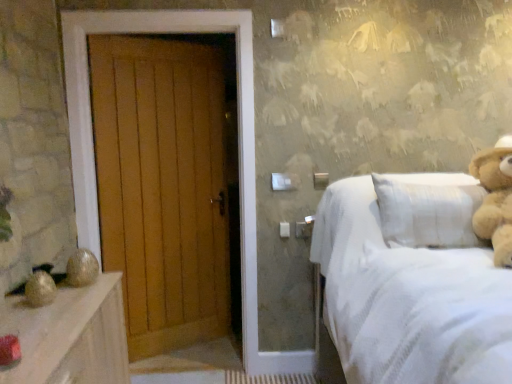
This screenshot has height=384, width=512. What do you see at coordinates (407, 299) in the screenshot? I see `white textured bed at right` at bounding box center [407, 299].

What do you see at coordinates (495, 198) in the screenshot? This screenshot has height=384, width=512. I see `light brown plush teddy bear at right` at bounding box center [495, 198].

You are a GUI agent. You are given a task and a screenshot of the screen. Output one action in this format:
    pyautogui.click(x=<x>, y=<y>)
    Task: Click on the wooden door at left
    Image resolution: width=512 pixels, height=384 pixels.
    Given the screenshot: What is the action you would take?
    pyautogui.click(x=168, y=184)

Would you say white textured bed at right is outside light brown plush teddy bear at right?

white textured bed at right is positioned outside light brown plush teddy bear at right.

Are white textured bed at right and light brown plush teddy bear at right located far from each other?

No, there isn't a large distance between white textured bed at right and light brown plush teddy bear at right.

Considering the relative positions of white textured bed at right and light brown plush teddy bear at right in the image provided, is white textured bed at right to the right of light brown plush teddy bear at right from the viewer's perspective?

No, white textured bed at right is not to the right of light brown plush teddy bear at right.

Is point (425, 332) farther from viewer compared to point (474, 174)?

No, (425, 332) is closer to viewer.

Can you confirm if light brown plush teddy bear at right is taller than wooden door at left?

In fact, light brown plush teddy bear at right may be shorter than wooden door at left.

Can you confirm if light brown plush teddy bear at right is smaller than wooden door at left?

Correct, light brown plush teddy bear at right occupies less space than wooden door at left.

Looking at this image, can you confirm if light brown plush teddy bear at right is wider than wooden door at left?

Indeed, light brown plush teddy bear at right has a greater width compared to wooden door at left.

From a real-world perspective, is light brown plush teddy bear at right physically located above or below wooden door at left?

light brown plush teddy bear at right is above wooden door at left.

Is wooden door at left facing towards light brown plush teddy bear at right?

No, wooden door at left is not turned towards light brown plush teddy bear at right.

Identify the location of door lying below the light brown plush teddy bear at right (from the image's perspective). The image size is (512, 384). (168, 184).

Is wooden door at left next to light brown plush teddy bear at right and touching it?

wooden door at left and light brown plush teddy bear at right are not in contact.

Based on the photo, considering the sizes of objects wooden door at left and light brown plush teddy bear at right in the image provided, who is shorter, wooden door at left or light brown plush teddy bear at right?

light brown plush teddy bear at right.

Does wooden door at left have a smaller size compared to white textured bed at right?

Indeed, wooden door at left has a smaller size compared to white textured bed at right.

From the image's perspective, is wooden door at left above or below white textured bed at right?

From the image's perspective, wooden door at left appears above white textured bed at right.

Is point (217, 113) in front of point (334, 274)?

No.

From a real-world perspective, is wooden door at left physically below white textured bed at right?

Incorrect, from a real-world perspective, wooden door at left is higher than white textured bed at right.

Does light brown plush teddy bear at right have a lesser height compared to white textured bed at right?

Correct, light brown plush teddy bear at right is not as tall as white textured bed at right.

Does light brown plush teddy bear at right have a greater width compared to white textured bed at right?

No.

Which is nearer, (476, 164) or (359, 241)?

Clearly, point (476, 164) is more distant from the camera than point (359, 241).

Can you confirm if white textured bed at right is shorter than wooden door at left?

Indeed, white textured bed at right has a lesser height compared to wooden door at left.

Could you tell me if white textured bed at right is facing wooden door at left?

No, white textured bed at right is not aimed at wooden door at left.

Is white textured bed at right outside of wooden door at left?

That's correct, white textured bed at right is outside of wooden door at left.

You are a GUI agent. You are given a task and a screenshot of the screen. Output one action in this format:
    pyautogui.click(x=<x>, y=<y>)
    Task: Click on the bed below the light brown plush teddy bear at right (from a real-world perspective)
    The image size is (512, 384).
    Given the screenshot: What is the action you would take?
    pyautogui.click(x=407, y=299)

You are a GUI agent. You are given a task and a screenshot of the screen. Output one action in this format:
    pyautogui.click(x=<x>, y=<y>)
    Task: Click on the teddy bear that is in front of the wooden door at left
    This screenshot has width=512, height=384.
    Given the screenshot: What is the action you would take?
    pyautogui.click(x=495, y=198)

Estimate the real-world distances between objects in this image. Which object is closer to white textured bed at right, wooden door at left or light brown plush teddy bear at right?

light brown plush teddy bear at right lies closer to white textured bed at right than the other object.

Looking at the image, which one is located closer to wooden door at left, white textured bed at right or light brown plush teddy bear at right?

The object closer to wooden door at left is white textured bed at right.

Looking at the image, which one is located further to wooden door at left, light brown plush teddy bear at right or white textured bed at right?

light brown plush teddy bear at right is further to wooden door at left.

Based on the photo, when comparing their distances from light brown plush teddy bear at right, does wooden door at left or white textured bed at right seem closer?

The object closer to light brown plush teddy bear at right is white textured bed at right.

Looking at the image, which one is located closer to white textured bed at right, light brown plush teddy bear at right or wooden door at left?

Based on the image, light brown plush teddy bear at right appears to be nearer to white textured bed at right.

Based on their spatial positions, is white textured bed at right or wooden door at left further from light brown plush teddy bear at right?

Among the two, wooden door at left is located further to light brown plush teddy bear at right.

Where is `bed located between wooden door at left and light brown plush teddy bear at right in the left-right direction`? This screenshot has height=384, width=512. bed located between wooden door at left and light brown plush teddy bear at right in the left-right direction is located at coordinates (407, 299).